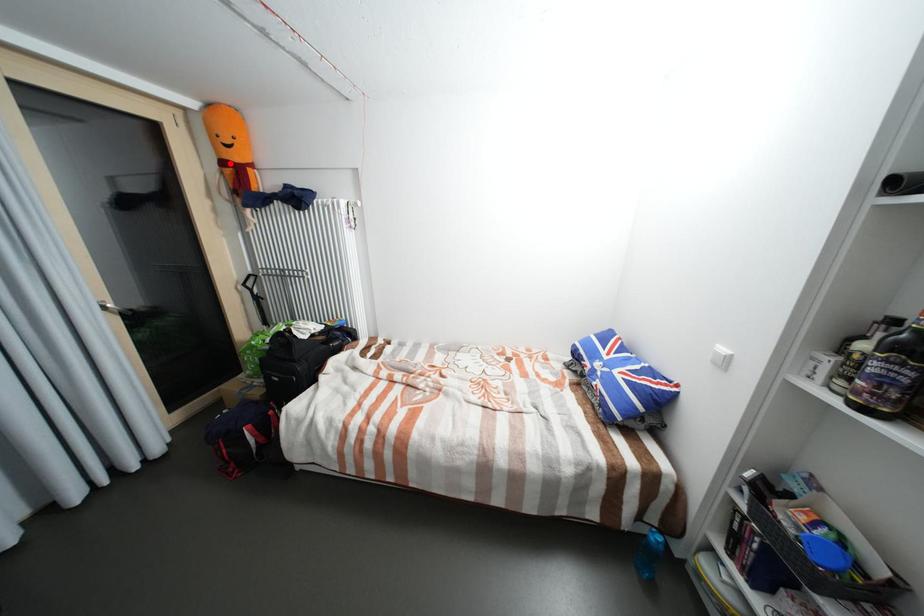
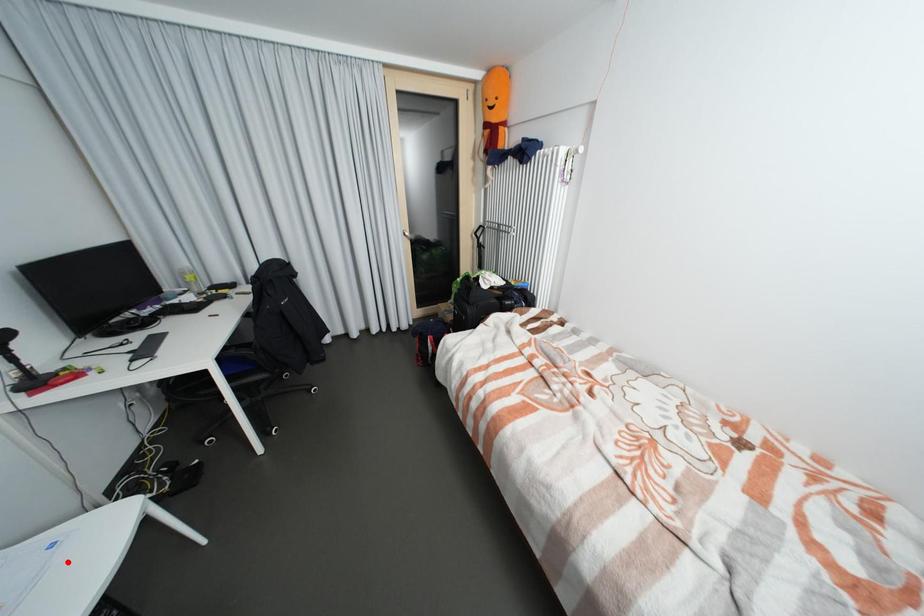
Based on the photo, I am providing you with two images of the same scene from different viewpoints. A red point is marked on the first image and another point is marked on the second image. Is the red point in image1 aligned with the point shown in image2?

No